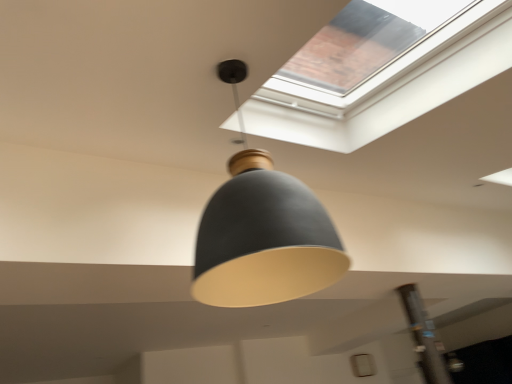
This screenshot has width=512, height=384. Describe the element at coordinates (262, 231) in the screenshot. I see `matte black lampshade at center` at that location.

Where is `matte black lampshade at center`? The height and width of the screenshot is (384, 512). matte black lampshade at center is located at coordinates (262, 231).

Identify the location of matte black lampshade at center. (262, 231).